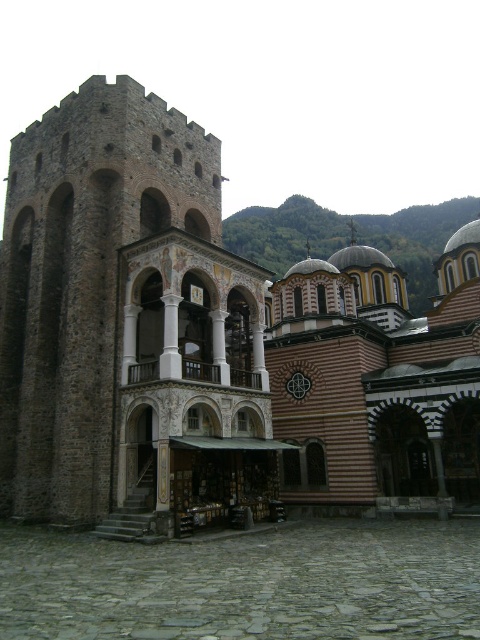
Question: Which of the following is the closest to the observer?

Choices:
 (A) (14, 321)
 (B) (272, 534)

Answer: (B)

Question: Is brown stone tower at left behind gray cobblestone courtyard at center?

Choices:
 (A) no
 (B) yes

Answer: (B)

Question: Does brown stone tower at left appear on the right side of gray cobblestone courtyard at center?

Choices:
 (A) yes
 (B) no

Answer: (A)

Question: Does brown stone tower at left have a greater width compared to gray cobblestone courtyard at center?

Choices:
 (A) yes
 (B) no

Answer: (A)

Question: Which of the following is the farthest from the observer?

Choices:
 (A) brown stone tower at left
 (B) gray cobblestone courtyard at center

Answer: (A)

Question: Which point is closer to the camera?

Choices:
 (A) (265, 545)
 (B) (429, 314)

Answer: (A)